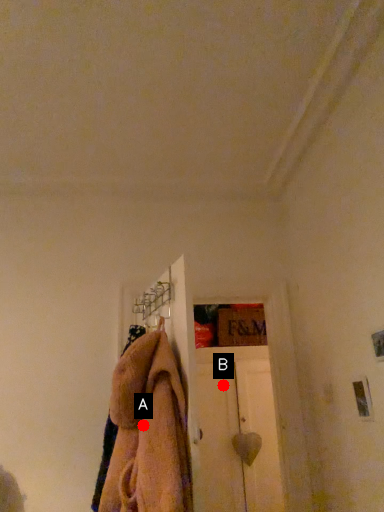
Question: Two points are circled on the image, labeled by A and B beside each circle. Which point appears farthest from the camera in this image?

Choices:
 (A) A is further
 (B) B is further

Answer: (B)